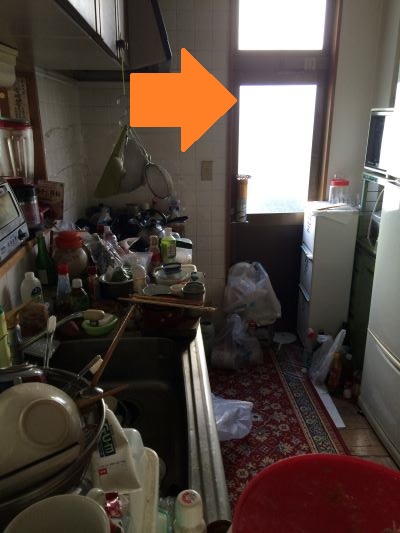
Identify the location of window. (290, 36).